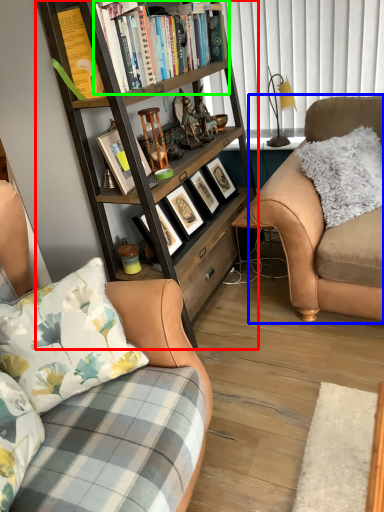
Question: Estimate the real-world distances between objects in this image. Which object is farther from bookcase (highlighted by a red box), studio couch (highlighted by a blue box) or book (highlighted by a green box)?

Choices:
 (A) studio couch
 (B) book

Answer: (A)